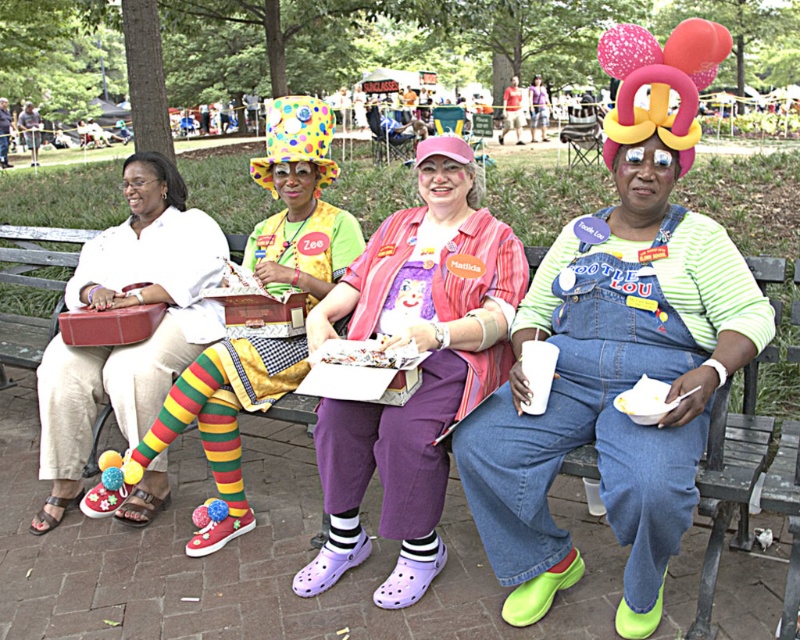
Question: Does wooden bench at center appear on the left side of striped socks at center?

Choices:
 (A) yes
 (B) no

Answer: (A)

Question: Which object is closer to the camera taking this photo?

Choices:
 (A) striped socks at center
 (B) pink fabric dress at center
 (C) wooden bench at center

Answer: (C)

Question: Which object is the closest to the striped socks at center?

Choices:
 (A) wooden bench at center
 (B) beige fabric purse at left
 (C) pink fabric dress at center
 (D) denim overalls at center

Answer: (B)

Question: Estimate the real-world distances between objects in this image. Which object is closer to the striped socks at center?

Choices:
 (A) denim overalls at center
 (B) beige fabric purse at left
 (C) wooden bench at center

Answer: (B)

Question: Can you confirm if wooden bench at center is positioned to the left of beige fabric purse at left?

Choices:
 (A) yes
 (B) no

Answer: (B)

Question: Is wooden bench at center below pink fabric dress at center?

Choices:
 (A) no
 (B) yes

Answer: (B)